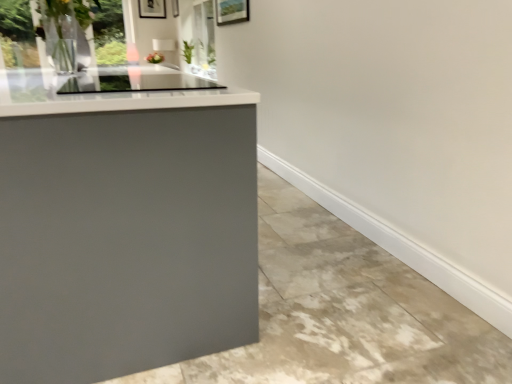
In order to face matte black picture frame at upper center, the first picture frame when ordered from left to right, should I rotate leftwards or rightwards?

It's best to rotate left around 13.687 degrees.

This screenshot has height=384, width=512. In order to click on matte gray concrete at lower left in this screenshot , I will do `click(343, 312)`.

This screenshot has width=512, height=384. Describe the element at coordinates (343, 312) in the screenshot. I see `matte gray concrete at lower left` at that location.

What do you see at coordinates (175, 8) in the screenshot? The height and width of the screenshot is (384, 512). I see `metallic silver picture frame at upper center, acting as the second picture frame starting from the left` at bounding box center [175, 8].

In order to click on matte black picture frame at upper center, arranged as the 2th picture frame when viewed from the right in this screenshot , I will do `click(152, 9)`.

Is metallic silver picture frame at upper center, the 1th picture frame when ordered from right to left, situated inside matte black picture frame at upper center, arranged as the 2th picture frame when viewed from the right, or outside?

metallic silver picture frame at upper center, the 1th picture frame when ordered from right to left, lies outside matte black picture frame at upper center, arranged as the 2th picture frame when viewed from the right.

Is metallic silver picture frame at upper center, acting as the second picture frame starting from the left, closer to the viewer compared to matte black picture frame at upper center, the first picture frame when ordered from left to right?

Yes, it is in front of matte black picture frame at upper center, the first picture frame when ordered from left to right.

Between metallic silver picture frame at upper center, the 1th picture frame when ordered from right to left, and matte black picture frame at upper center, arranged as the 2th picture frame when viewed from the right, which one appears on the right side from the viewer's perspective?

metallic silver picture frame at upper center, the 1th picture frame when ordered from right to left.

Consider the image. Between metallic silver picture frame at upper center, the 1th picture frame when ordered from right to left, and matte black picture frame at upper center, arranged as the 2th picture frame when viewed from the right, which one has smaller size?

Smaller between the two is matte black picture frame at upper center, arranged as the 2th picture frame when viewed from the right.

At what (x,y) coordinates should I click in order to perform the action: click on concrete below the transparent glass window at upper left (from a real-world perspective). Please return your answer as a coordinate pair (x, y). Looking at the image, I should click on 343,312.

From a real-world perspective, is matte gray concrete at lower left physically located above or below transparent glass window at upper left?

Clearly, from a real-world perspective, matte gray concrete at lower left is below transparent glass window at upper left.

Is matte gray concrete at lower left aimed at transparent glass window at upper left?

No, matte gray concrete at lower left does not turn towards transparent glass window at upper left.

How many degrees apart are the facing directions of matte gray concrete at lower left and transparent glass window at upper left?

matte gray concrete at lower left and transparent glass window at upper left are facing 89.9 degrees away from each other.

Which is correct: transparent glass window at upper left is inside matte gray concrete at lower left, or outside of it?

transparent glass window at upper left is located beyond the bounds of matte gray concrete at lower left.

Considering the sizes of objects transparent glass window at upper left and matte gray concrete at lower left in the image provided, who is thinner, transparent glass window at upper left or matte gray concrete at lower left?

transparent glass window at upper left is thinner.

From their relative heights in the image, would you say transparent glass window at upper left is taller or shorter than matte gray concrete at lower left?

Considering their sizes, transparent glass window at upper left has more height than matte gray concrete at lower left.

From the image's perspective, who appears lower, matte gray concrete at lower left or metallic silver picture frame at upper center, the 1th picture frame when ordered from right to left?

matte gray concrete at lower left is shown below in the image.

Could you tell me if matte gray concrete at lower left is facing metallic silver picture frame at upper center, acting as the second picture frame starting from the left?

No, matte gray concrete at lower left is not facing towards metallic silver picture frame at upper center, acting as the second picture frame starting from the left.

In the scene shown: Is matte gray concrete at lower left positioned far away from metallic silver picture frame at upper center, acting as the second picture frame starting from the left?

A: matte gray concrete at lower left is positioned a significant distance from metallic silver picture frame at upper center, acting as the second picture frame starting from the left.

Considering the relative positions of matte gray concrete at lower left and metallic silver picture frame at upper center, the 1th picture frame when ordered from right to left, in the image provided, is matte gray concrete at lower left to the left or to the right of metallic silver picture frame at upper center, the 1th picture frame when ordered from right to left,?

In the image, matte gray concrete at lower left appears on the right side of metallic silver picture frame at upper center, the 1th picture frame when ordered from right to left.

In terms of height, does transparent glass window at upper left look taller or shorter compared to matte black picture frame at upper center, the first picture frame when ordered from left to right?

In the image, transparent glass window at upper left appears to be taller than matte black picture frame at upper center, the first picture frame when ordered from left to right.

Considering their positions, is transparent glass window at upper left located in front of or behind matte black picture frame at upper center, arranged as the 2th picture frame when viewed from the right?

Visually, transparent glass window at upper left is located in front of matte black picture frame at upper center, arranged as the 2th picture frame when viewed from the right.

Could you tell me if transparent glass window at upper left is turned towards matte black picture frame at upper center, arranged as the 2th picture frame when viewed from the right?

No.

From a real-world perspective, relative to matte black picture frame at upper center, arranged as the 2th picture frame when viewed from the right, is transparent glass window at upper left vertically above or below?

Clearly, from a real-world perspective, transparent glass window at upper left is below matte black picture frame at upper center, arranged as the 2th picture frame when viewed from the right.

Considering the sizes of transparent glass window at upper left and metallic silver picture frame at upper center, the 1th picture frame when ordered from right to left, in the image, is transparent glass window at upper left wider or thinner than metallic silver picture frame at upper center, the 1th picture frame when ordered from right to left,?

In the image, transparent glass window at upper left appears to be wider than metallic silver picture frame at upper center, the 1th picture frame when ordered from right to left.

Would you consider transparent glass window at upper left to be distant from metallic silver picture frame at upper center, the 1th picture frame when ordered from right to left?

Yes, transparent glass window at upper left and metallic silver picture frame at upper center, the 1th picture frame when ordered from right to left, are quite far apart.

Which is more distant, (118, 18) or (174, 8)?

The point (174, 8) is farther from the camera.

Who is smaller, transparent glass window at upper left or metallic silver picture frame at upper center, acting as the second picture frame starting from the left?

With smaller size is metallic silver picture frame at upper center, acting as the second picture frame starting from the left.

Can you tell me how much metallic silver picture frame at upper center, the 1th picture frame when ordered from right to left, and transparent glass window at upper left differ in facing direction?

There is a 0.789-degree angle between the facing directions of metallic silver picture frame at upper center, the 1th picture frame when ordered from right to left, and transparent glass window at upper left.

Consider the image. Is metallic silver picture frame at upper center, the 1th picture frame when ordered from right to left, with transparent glass window at upper left?

No, metallic silver picture frame at upper center, the 1th picture frame when ordered from right to left, is not beside transparent glass window at upper left.

From the picture: Which point is more forward, (176, 8) or (17, 12)?

Positioned in front is point (17, 12).

From the image's perspective, would you say metallic silver picture frame at upper center, acting as the second picture frame starting from the left, is shown under transparent glass window at upper left?

No, from the image's perspective, metallic silver picture frame at upper center, acting as the second picture frame starting from the left, is not beneath transparent glass window at upper left.

Identify the location of picture frame above the metallic silver picture frame at upper center, the 1th picture frame when ordered from right to left (from the image's perspective). (152, 9).

This screenshot has height=384, width=512. In order to click on concrete beneath the transparent glass window at upper left (from a real-world perspective) in this screenshot , I will do click(x=343, y=312).

Based on their spatial positions, is matte gray concrete at lower left or transparent glass window at upper left closer to metallic silver picture frame at upper center, acting as the second picture frame starting from the left?

Based on the image, transparent glass window at upper left appears to be nearer to metallic silver picture frame at upper center, acting as the second picture frame starting from the left.

When comparing their distances from transparent glass window at upper left, does matte gray concrete at lower left or matte black picture frame at upper center, arranged as the 2th picture frame when viewed from the right, seem further?

matte black picture frame at upper center, arranged as the 2th picture frame when viewed from the right, is further to transparent glass window at upper left.

Considering their positions, is transparent glass window at upper left positioned further to matte gray concrete at lower left than metallic silver picture frame at upper center, the 1th picture frame when ordered from right to left?

metallic silver picture frame at upper center, the 1th picture frame when ordered from right to left, lies further to matte gray concrete at lower left than the other object.

Based on their spatial positions, is matte black picture frame at upper center, the first picture frame when ordered from left to right, or metallic silver picture frame at upper center, the 1th picture frame when ordered from right to left, further from transparent glass window at upper left?

metallic silver picture frame at upper center, the 1th picture frame when ordered from right to left, is positioned further to the anchor transparent glass window at upper left.

From the image, which object appears to be nearer to metallic silver picture frame at upper center, acting as the second picture frame starting from the left, matte black picture frame at upper center, arranged as the 2th picture frame when viewed from the right, or transparent glass window at upper left?

matte black picture frame at upper center, arranged as the 2th picture frame when viewed from the right.

When comparing their distances from matte gray concrete at lower left, does matte black picture frame at upper center, arranged as the 2th picture frame when viewed from the right, or metallic silver picture frame at upper center, the 1th picture frame when ordered from right to left, seem further?

matte black picture frame at upper center, arranged as the 2th picture frame when viewed from the right, lies further to matte gray concrete at lower left than the other object.

From the image, which object appears to be nearer to matte black picture frame at upper center, the first picture frame when ordered from left to right, metallic silver picture frame at upper center, acting as the second picture frame starting from the left, or transparent glass window at upper left?

The object closer to matte black picture frame at upper center, the first picture frame when ordered from left to right, is metallic silver picture frame at upper center, acting as the second picture frame starting from the left.

Based on their spatial positions, is matte gray concrete at lower left or metallic silver picture frame at upper center, acting as the second picture frame starting from the left, closer to matte black picture frame at upper center, arranged as the 2th picture frame when viewed from the right?

Among the two, metallic silver picture frame at upper center, acting as the second picture frame starting from the left, is located nearer to matte black picture frame at upper center, arranged as the 2th picture frame when viewed from the right.

Locate an element on the screen. picture frame positioned between matte gray concrete at lower left and matte black picture frame at upper center, arranged as the 2th picture frame when viewed from the right, from near to far is located at coordinates (175, 8).

At what (x,y) coordinates should I click in order to perform the action: click on picture frame located between transparent glass window at upper left and matte black picture frame at upper center, arranged as the 2th picture frame when viewed from the right, in the depth direction. Please return your answer as a coordinate pair (x, y). Image resolution: width=512 pixels, height=384 pixels. Looking at the image, I should click on (175, 8).

Find the location of a particular element. window located between matte gray concrete at lower left and metallic silver picture frame at upper center, the 1th picture frame when ordered from right to left, in the depth direction is located at coordinates (17, 32).

You are a GUI agent. You are given a task and a screenshot of the screen. Output one action in this format:
    pyautogui.click(x=<x>, y=<y>)
    Task: Click on the window between matte gray concrete at lower left and matte black picture frame at upper center, arranged as the 2th picture frame when viewed from the right, along the z-axis
    This screenshot has height=384, width=512.
    Given the screenshot: What is the action you would take?
    point(17,32)